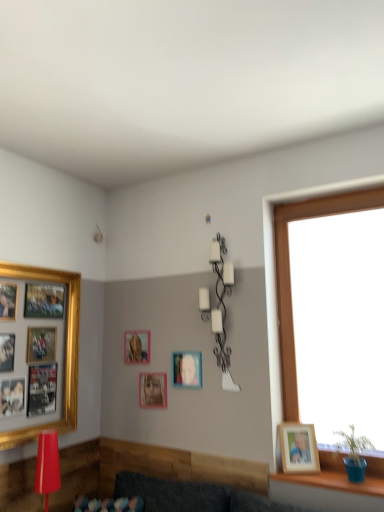
Question: Can you confirm if matte red lamp at lower left, which appears as the first lamp when viewed from the front, is positioned to the right of white matte wall sconce at upper center, acting as the first lamp starting from the top?

Choices:
 (A) yes
 (B) no

Answer: (B)

Question: Can you confirm if matte red lamp at lower left, the 2th lamp positioned from the back, is wider than white matte wall sconce at upper center, acting as the first lamp starting from the top?

Choices:
 (A) yes
 (B) no

Answer: (A)

Question: From a real-world perspective, does matte red lamp at lower left, which is the first lamp from left to right, stand above white matte wall sconce at upper center, which appears as the first lamp when viewed from the back?

Choices:
 (A) no
 (B) yes

Answer: (A)

Question: Would you say matte red lamp at lower left, the 2th lamp positioned from the back, is outside white matte wall sconce at upper center, acting as the first lamp starting from the top?

Choices:
 (A) no
 (B) yes

Answer: (B)

Question: Is matte red lamp at lower left, which is counted as the second lamp, starting from the top, not close to white matte wall sconce at upper center, the 1th lamp in the right-to-left sequence?

Choices:
 (A) yes
 (B) no

Answer: (A)

Question: Would you say white matte wall sconce at upper center, which appears as the first lamp when viewed from the back, is part of matte red lamp at lower left, which appears as the first lamp when viewed from the front,'s contents?

Choices:
 (A) no
 (B) yes

Answer: (A)

Question: Is matte gold picture frame at center, which ranks as the 2th picture frame in left-to-right order, shorter than wooden photo frame at right, which is the 1th picture frame from right to left?

Choices:
 (A) no
 (B) yes

Answer: (B)

Question: From a real-world perspective, is matte gold picture frame at center, arranged as the 4th picture frame when viewed from the right, below wooden photo frame at right, the fifth picture frame positioned from the left?

Choices:
 (A) yes
 (B) no

Answer: (B)

Question: From the image's perspective, is matte gold picture frame at center, arranged as the 4th picture frame when viewed from the right, on top of wooden photo frame at right, the fifth picture frame positioned from the left?

Choices:
 (A) no
 (B) yes

Answer: (B)

Question: Is matte gold picture frame at center, which ranks as the 2th picture frame in left-to-right order, turned away from wooden photo frame at right, which is the 1th picture frame from right to left?

Choices:
 (A) yes
 (B) no

Answer: (B)

Question: Considering the relative sizes of matte gold picture frame at center, which ranks as the 2th picture frame in left-to-right order, and wooden photo frame at right, the fifth picture frame positioned from the left, in the image provided, is matte gold picture frame at center, which ranks as the 2th picture frame in left-to-right order, smaller than wooden photo frame at right, the fifth picture frame positioned from the left,?

Choices:
 (A) yes
 (B) no

Answer: (A)

Question: Can you confirm if matte gold picture frame at center, arranged as the 4th picture frame when viewed from the right, is positioned to the right of wooden photo frame at right, which is the 1th picture frame from right to left?

Choices:
 (A) no
 (B) yes

Answer: (A)

Question: Is wooden photo frame at right, the fifth picture frame positioned from the left, outside of gold-framed collage at left, which ranks as the fifth picture frame in right-to-left order?

Choices:
 (A) no
 (B) yes

Answer: (B)